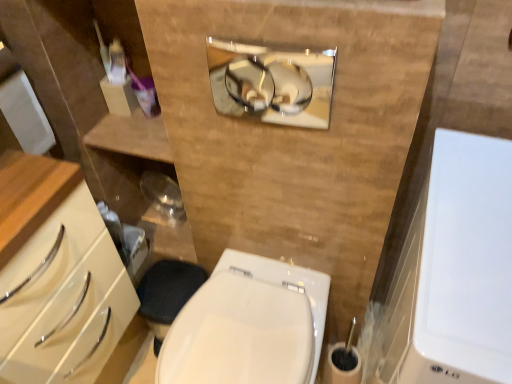
Image resolution: width=512 pixels, height=384 pixels. What do you see at coordinates (272, 81) in the screenshot? I see `polished chrome mirror at upper center, the first medicine cabinet viewed from the left` at bounding box center [272, 81].

Describe the element at coordinates (454, 271) in the screenshot. I see `white glossy medicine cabinet at right, arranged as the first medicine cabinet when ordered from the bottom` at that location.

Find the location of a particular element. white glossy bidet at center is located at coordinates (239, 335).

Is point (286, 333) more distant than point (432, 380)?

Yes.

From the image's perspective, would you say white glossy bidet at center is shown under white glossy medicine cabinet at right, the second medicine cabinet viewed from the left?

Correct, white glossy bidet at center appears lower than white glossy medicine cabinet at right, the second medicine cabinet viewed from the left, in the image.

Could you tell me if white glossy bidet at center is turned towards white glossy medicine cabinet at right, marked as the 2th medicine cabinet in a top-to-bottom arrangement?

No, white glossy bidet at center is not facing towards white glossy medicine cabinet at right, marked as the 2th medicine cabinet in a top-to-bottom arrangement.

From the image's perspective, would you say polished chrome mirror at upper center, which is counted as the 2th medicine cabinet, starting from the right, is shown under white glossy bidet at center?

No, from the image's perspective, polished chrome mirror at upper center, which is counted as the 2th medicine cabinet, starting from the right, is not below white glossy bidet at center.

Locate an element on the screen. Image resolution: width=512 pixels, height=384 pixels. bidet located on the left of polished chrome mirror at upper center, the 1th medicine cabinet positioned from the top is located at coordinates (239, 335).

Is polished chrome mirror at upper center, the first medicine cabinet viewed from the left, aimed at white glossy bidet at center?

No, polished chrome mirror at upper center, the first medicine cabinet viewed from the left, is not aimed at white glossy bidet at center.

Which object is thinner, polished chrome mirror at upper center, the first medicine cabinet viewed from the left, or white glossy bidet at center?

With smaller width is polished chrome mirror at upper center, the first medicine cabinet viewed from the left.

Could you tell me if polished chrome mirror at upper center, the first medicine cabinet viewed from the left, is facing white glossy medicine cabinet at right, marked as the 2th medicine cabinet in a top-to-bottom arrangement?

No, polished chrome mirror at upper center, the first medicine cabinet viewed from the left, is not oriented towards white glossy medicine cabinet at right, marked as the 2th medicine cabinet in a top-to-bottom arrangement.

Does polished chrome mirror at upper center, which is counted as the second medicine cabinet, starting from the bottom, come behind white glossy medicine cabinet at right, the 2th medicine cabinet when ordered from back to front?

Yes, it is.

Looking at this image, is polished chrome mirror at upper center, which is the 2th medicine cabinet in front-to-back order, positioned far away from white glossy medicine cabinet at right, marked as the 2th medicine cabinet in a top-to-bottom arrangement?

No, polished chrome mirror at upper center, which is the 2th medicine cabinet in front-to-back order, is in close proximity to white glossy medicine cabinet at right, marked as the 2th medicine cabinet in a top-to-bottom arrangement.

Can you confirm if white glossy medicine cabinet at right, marked as the 2th medicine cabinet in a top-to-bottom arrangement, is bigger than polished chrome mirror at upper center, the first medicine cabinet viewed from the left?

Correct, white glossy medicine cabinet at right, marked as the 2th medicine cabinet in a top-to-bottom arrangement, is larger in size than polished chrome mirror at upper center, the first medicine cabinet viewed from the left.

Which of these two, white glossy medicine cabinet at right, arranged as the first medicine cabinet when viewed from the front, or polished chrome mirror at upper center, which is the 2th medicine cabinet in front-to-back order, is wider?

Wider between the two is white glossy medicine cabinet at right, arranged as the first medicine cabinet when viewed from the front.

Would you say white glossy medicine cabinet at right, the second medicine cabinet viewed from the left, is a long distance from polished chrome mirror at upper center, which is counted as the 2th medicine cabinet, starting from the right?

No, white glossy medicine cabinet at right, the second medicine cabinet viewed from the left, is in close proximity to polished chrome mirror at upper center, which is counted as the 2th medicine cabinet, starting from the right.

Which is closer, (483, 320) or (304, 85)?

Point (483, 320) appears to be closer to the viewer than point (304, 85).

Consider the image. Is white glossy bidet at center bigger or smaller than polished chrome mirror at upper center, which appears as the 1th medicine cabinet when viewed from the back?

white glossy bidet at center is bigger than polished chrome mirror at upper center, which appears as the 1th medicine cabinet when viewed from the back.

Is point (226, 280) farther from camera compared to point (267, 88)?

That is False.

Can you tell me how much white glossy bidet at center and polished chrome mirror at upper center, the 1th medicine cabinet positioned from the top, differ in facing direction?

The angle between the facing direction of white glossy bidet at center and the facing direction of polished chrome mirror at upper center, the 1th medicine cabinet positioned from the top, is 1.37 degrees.

Considering the relative sizes of white glossy bidet at center and polished chrome mirror at upper center, which is counted as the 2th medicine cabinet, starting from the right, in the image provided, is white glossy bidet at center thinner than polished chrome mirror at upper center, which is counted as the 2th medicine cabinet, starting from the right,?

Incorrect, the width of white glossy bidet at center is not less than that of polished chrome mirror at upper center, which is counted as the 2th medicine cabinet, starting from the right.

The width and height of the screenshot is (512, 384). In order to click on bidet lying on the left of white glossy medicine cabinet at right, marked as the 2th medicine cabinet in a top-to-bottom arrangement in this screenshot , I will do `click(239, 335)`.

Is white glossy medicine cabinet at right, arranged as the first medicine cabinet when viewed from the front, thinner than white glossy bidet at center?

No, white glossy medicine cabinet at right, arranged as the first medicine cabinet when viewed from the front, is not thinner than white glossy bidet at center.

From the image's perspective, is white glossy medicine cabinet at right, the 2th medicine cabinet when ordered from back to front, above or below white glossy bidet at center?

Clearly, from the image's perspective, white glossy medicine cabinet at right, the 2th medicine cabinet when ordered from back to front, is above white glossy bidet at center.

Measure the distance between white glossy medicine cabinet at right, marked as the 2th medicine cabinet in a top-to-bottom arrangement, and white glossy bidet at center.

They are 16.36 inches apart.

The height and width of the screenshot is (384, 512). In order to click on the 1st medicine cabinet above when counting from the white glossy bidet at center (from the image's perspective) in this screenshot , I will do `click(454, 271)`.

In order to click on bidet below the polished chrome mirror at upper center, the 1th medicine cabinet positioned from the top (from the image's perspective) in this screenshot , I will do `click(239, 335)`.

Based on their spatial positions, is white glossy bidet at center or polished chrome mirror at upper center, which appears as the 1th medicine cabinet when viewed from the back, closer to white glossy medicine cabinet at right, arranged as the first medicine cabinet when ordered from the bottom?

The object closer to white glossy medicine cabinet at right, arranged as the first medicine cabinet when ordered from the bottom, is white glossy bidet at center.

In the scene shown: Looking at the image, which one is located closer to polished chrome mirror at upper center, which is the 2th medicine cabinet in front-to-back order, white glossy bidet at center or white glossy medicine cabinet at right, which is counted as the 1th medicine cabinet, starting from the right?

white glossy medicine cabinet at right, which is counted as the 1th medicine cabinet, starting from the right, lies closer to polished chrome mirror at upper center, which is the 2th medicine cabinet in front-to-back order, than the other object.

Consider the image. When comparing their distances from white glossy medicine cabinet at right, arranged as the first medicine cabinet when viewed from the front, does polished chrome mirror at upper center, which is counted as the second medicine cabinet, starting from the bottom, or white glossy bidet at center seem further?

polished chrome mirror at upper center, which is counted as the second medicine cabinet, starting from the bottom.

Looking at the image, which one is located closer to white glossy bidet at center, polished chrome mirror at upper center, which appears as the 1th medicine cabinet when viewed from the back, or white glossy medicine cabinet at right, the 2th medicine cabinet when ordered from back to front?

white glossy medicine cabinet at right, the 2th medicine cabinet when ordered from back to front.

Looking at this image, estimate the real-world distances between objects in this image. Which object is closer to white glossy bidet at center, white glossy medicine cabinet at right, arranged as the first medicine cabinet when ordered from the bottom, or polished chrome mirror at upper center, which is counted as the second medicine cabinet, starting from the bottom?

The object closer to white glossy bidet at center is white glossy medicine cabinet at right, arranged as the first medicine cabinet when ordered from the bottom.

Based on their spatial positions, is white glossy medicine cabinet at right, arranged as the first medicine cabinet when viewed from the front, or white glossy bidet at center further from polished chrome mirror at upper center, which is the 2th medicine cabinet in front-to-back order?

Among the two, white glossy bidet at center is located further to polished chrome mirror at upper center, which is the 2th medicine cabinet in front-to-back order.

This screenshot has width=512, height=384. Identify the location of medicine cabinet between polished chrome mirror at upper center, the first medicine cabinet viewed from the left, and white glossy bidet at center in the up-down direction. (454, 271).